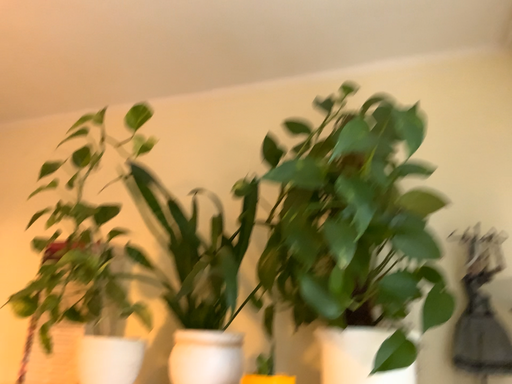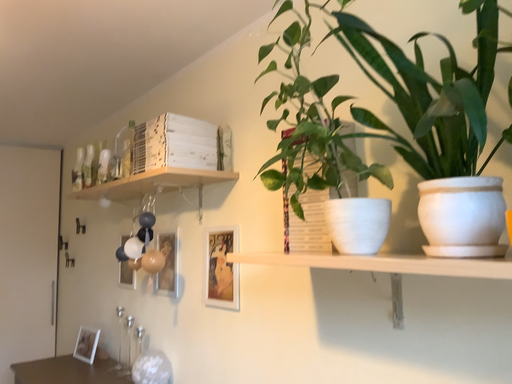
Question: Which way did the camera rotate in the video?

Choices:
 (A) rotated right
 (B) rotated left

Answer: (B)